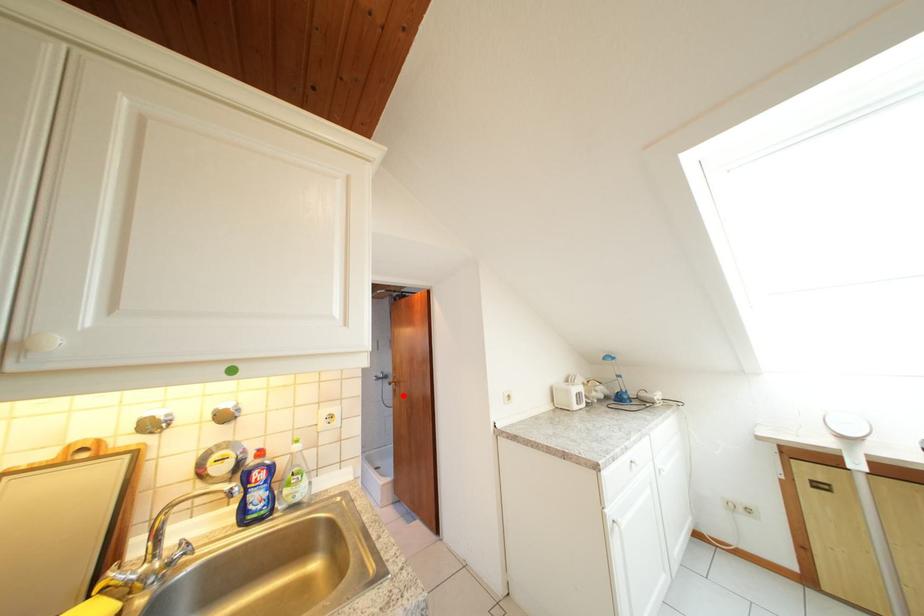
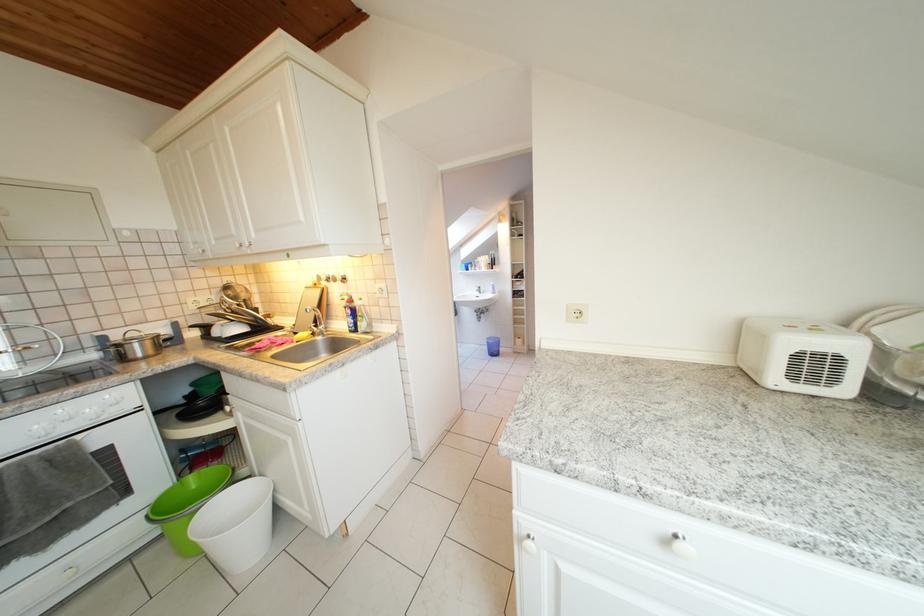
Question: I am providing you with two images of the same scene from different viewpoints. A red point is marked on the first image. Can you still see the location of the red point in image 2?

Choices:
 (A) Yes
 (B) No

Answer: (B)